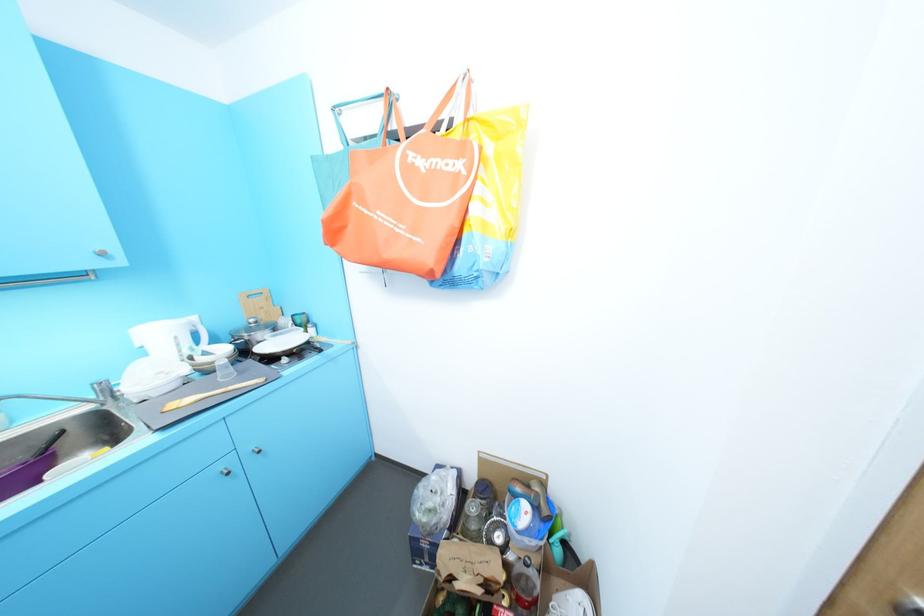
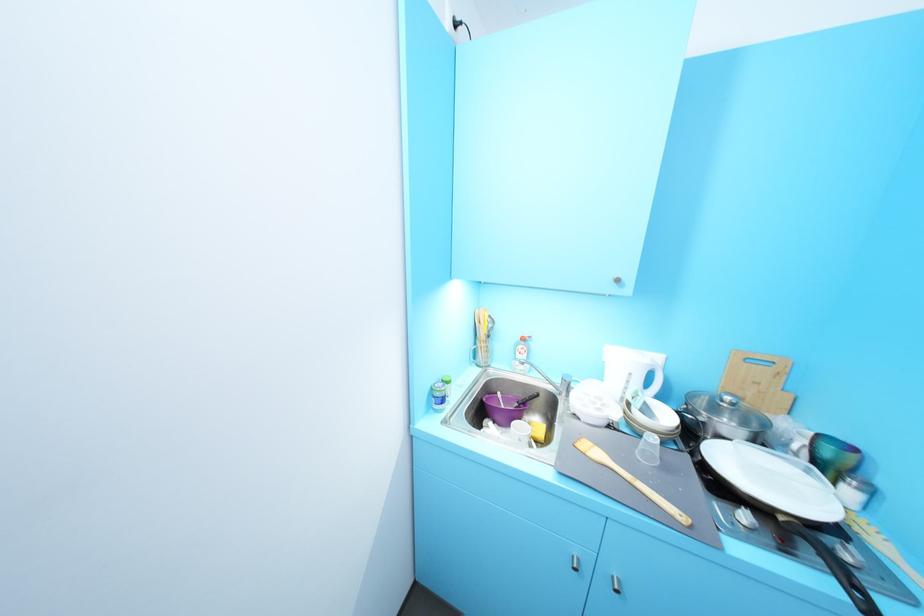
Find the pixel in the second image that matches point 259,321 in the first image.

(735, 399)